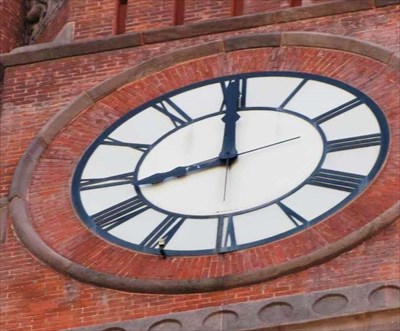
Identify the location of clock. The width and height of the screenshot is (400, 331). (232, 165).